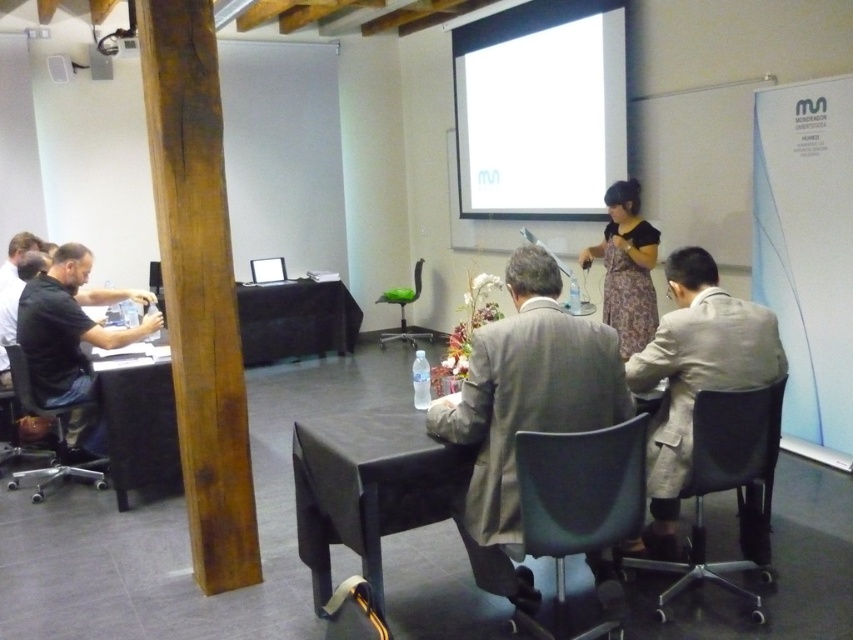
You are standing at the entrance of the conference room and want to locate the light brown suit at center. Based on the coordinates provided, in which direction should you look to find it?

You should look towards the center of the image because the light brown suit at center is located at point (524, 410), which corresponds to the central area.

You are standing in the conference room and want to walk to the point marked at coordinates (524, 410). However, there is a large wooden pillar in the way. Can you walk around the pillar to reach that point?

The point marked at coordinates (524, 410) is located on the light brown suit at center. Since the pillar is in the foreground and obstructs the view, it is likely blocking the path. To reach the point, you would need to navigate around the pillar to access the central area where the light brown suit is situated.